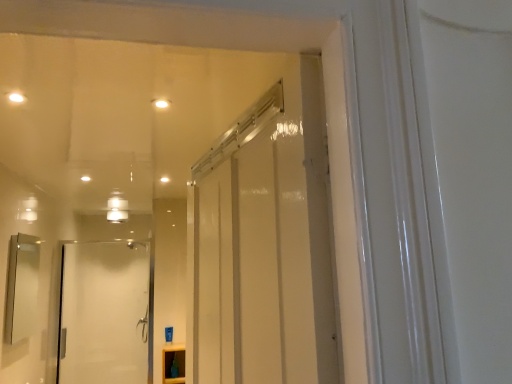
Describe the element at coordinates (104, 314) in the screenshot. I see `white glass door at left` at that location.

The height and width of the screenshot is (384, 512). I want to click on matte white cabinet at lower center, so click(172, 364).

The height and width of the screenshot is (384, 512). What do you see at coordinates (21, 287) in the screenshot?
I see `matte silver mirror at left` at bounding box center [21, 287].

The image size is (512, 384). I want to click on white glass door at left, so click(104, 314).

Which is correct: matte silver mirror at left is inside white glass door at left, or outside of it?

matte silver mirror at left is outside white glass door at left.

Which of these two, matte silver mirror at left or white glass door at left, stands taller?

Standing taller between the two is white glass door at left.

Is matte silver mirror at left facing towards white glass door at left?

No, matte silver mirror at left does not turn towards white glass door at left.

From the picture: Is matte silver mirror at left at the back of matte white cabinet at lower center?

matte white cabinet at lower center is not turned away from matte silver mirror at left.

Between matte white cabinet at lower center and matte silver mirror at left, which one has smaller size?

matte white cabinet at lower center is smaller.

Between matte white cabinet at lower center and matte silver mirror at left, which one has more height?

Standing taller between the two is matte silver mirror at left.

Considering the positions of point (170, 350) and point (15, 257), is point (170, 350) closer or farther from the camera than point (15, 257)?

Point (170, 350) is positioned farther from the camera compared to point (15, 257).

From the picture: From the image's perspective, is white glass door at left on matte silver mirror at left?

Actually, white glass door at left appears below matte silver mirror at left in the image.

Between white glass door at left and matte silver mirror at left, which one has less height?

matte silver mirror at left.

From the picture: Does white glass door at left appear on the left side of matte silver mirror at left?

No, white glass door at left is not to the left of matte silver mirror at left.

I want to click on door that appears on the right of matte silver mirror at left, so pos(104,314).

Where is `door that is on the left side of matte white cabinet at lower center`? This screenshot has width=512, height=384. door that is on the left side of matte white cabinet at lower center is located at coordinates (104, 314).

Between white glass door at left and matte white cabinet at lower center, which one appears on the left side from the viewer's perspective?

white glass door at left.

Does white glass door at left touch matte white cabinet at lower center?

white glass door at left and matte white cabinet at lower center are clearly separated.

In the image, is white glass door at left positioned in front of or behind matte white cabinet at lower center?

white glass door at left is positioned farther from the viewer than matte white cabinet at lower center.

Identify the location of mirror lying above the matte white cabinet at lower center (from the image's perspective). The width and height of the screenshot is (512, 384). (21, 287).

Between matte silver mirror at left and matte white cabinet at lower center, which one is positioned behind?

matte white cabinet at lower center is further away from the camera.

Is matte silver mirror at left oriented towards matte white cabinet at lower center?

No, matte silver mirror at left does not turn towards matte white cabinet at lower center.

Looking at this image, does matte silver mirror at left appear on the left side of matte white cabinet at lower center?

Yes, matte silver mirror at left is to the left of matte white cabinet at lower center.

Is matte white cabinet at lower center located outside white glass door at left?

Yes, matte white cabinet at lower center is not within white glass door at left.

Can you confirm if matte white cabinet at lower center is smaller than white glass door at left?

Yes, matte white cabinet at lower center is smaller than white glass door at left.

In the image, is matte white cabinet at lower center on the left side or the right side of white glass door at left?

matte white cabinet at lower center is to the right of white glass door at left.

Considering the points (165, 377) and (138, 280), which point is behind, point (165, 377) or point (138, 280)?

The point (138, 280) is more distant.

The height and width of the screenshot is (384, 512). I want to click on mirror on the left side of white glass door at left, so click(21, 287).

Locate an element on the screen. mirror above the matte white cabinet at lower center (from the image's perspective) is located at coordinates (21, 287).

When comparing their distances from matte silver mirror at left, does white glass door at left or matte white cabinet at lower center seem further?

Among the two, white glass door at left is located further to matte silver mirror at left.

From the image, which object appears to be nearer to matte white cabinet at lower center, white glass door at left or matte silver mirror at left?

matte silver mirror at left lies closer to matte white cabinet at lower center than the other object.

Estimate the real-world distances between objects in this image. Which object is closer to white glass door at left, matte white cabinet at lower center or matte silver mirror at left?

matte white cabinet at lower center.

Estimate the real-world distances between objects in this image. Which object is further from white glass door at left, matte silver mirror at left or matte white cabinet at lower center?

Among the two, matte silver mirror at left is located further to white glass door at left.

Looking at the image, which one is located further to matte silver mirror at left, matte white cabinet at lower center or white glass door at left?

white glass door at left.

Which object lies nearer to the anchor point matte white cabinet at lower center, matte silver mirror at left or white glass door at left?

Based on the image, matte silver mirror at left appears to be nearer to matte white cabinet at lower center.

This screenshot has width=512, height=384. I want to click on cabinetry between matte silver mirror at left and white glass door at left along the z-axis, so [172, 364].